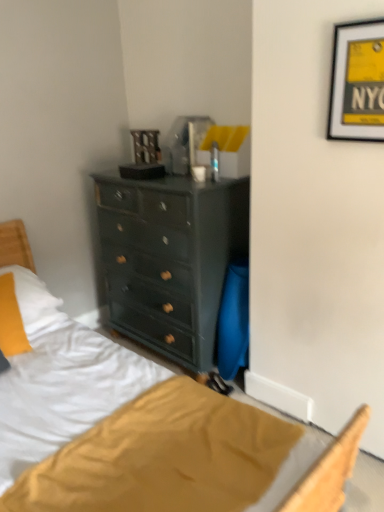
You are a GUI agent. You are given a task and a screenshot of the screen. Output one action in this format:
    pyautogui.click(x=<x>, y=<y>)
    Task: Click on the soft yellow pillow at lower left
    Image resolution: width=384 pixels, height=512 pixels.
    Given the screenshot: What is the action you would take?
    pyautogui.click(x=11, y=320)

The image size is (384, 512). Describe the element at coordinates (11, 320) in the screenshot. I see `soft yellow pillow at lower left` at that location.

Measure the distance between point [3,349] and camera.

Point [3,349] and camera are 6.99 feet apart.

This screenshot has width=384, height=512. Describe the element at coordinates (357, 82) in the screenshot. I see `black matte picture frame at upper right` at that location.

Measure the distance between black matte picture frame at upper right and camera.

A distance of 1.52 meters exists between black matte picture frame at upper right and camera.

Identify the location of black matte picture frame at upper right. (357, 82).

In order to click on soft yellow pillow at lower left in this screenshot , I will do `click(11, 320)`.

Is black matte picture frame at upper right to the left or to the right of soft yellow pillow at lower left in the image?

Based on their positions, black matte picture frame at upper right is located to the right of soft yellow pillow at lower left.

Is black matte picture frame at upper right positioned behind soft yellow pillow at lower left?

No, black matte picture frame at upper right is in front of soft yellow pillow at lower left.

Is point (371, 56) positioned behind point (8, 307)?

No, it is in front of (8, 307).

From the image's perspective, which one is positioned higher, black matte picture frame at upper right or soft yellow pillow at lower left?

black matte picture frame at upper right.

From a real-world perspective, is black matte picture frame at upper right on top of soft yellow pillow at lower left?

Yes, from a real-world perspective, black matte picture frame at upper right is on top of soft yellow pillow at lower left.

Which of these two, black matte picture frame at upper right or soft yellow pillow at lower left, is thinner?

black matte picture frame at upper right.

Is black matte picture frame at upper right taller than soft yellow pillow at lower left?

Incorrect, the height of black matte picture frame at upper right is not larger of that of soft yellow pillow at lower left.

Does black matte picture frame at upper right have a smaller size compared to soft yellow pillow at lower left?

Yes.

Is black matte picture frame at upper right completely or partially outside of soft yellow pillow at lower left?

That's correct, black matte picture frame at upper right is outside of soft yellow pillow at lower left.

Is black matte picture frame at upper right placed right next to soft yellow pillow at lower left?

No, black matte picture frame at upper right is not in contact with soft yellow pillow at lower left.

Is black matte picture frame at upper right aimed at soft yellow pillow at lower left?

No, black matte picture frame at upper right does not turn towards soft yellow pillow at lower left.

The height and width of the screenshot is (512, 384). I want to click on pillow behind the black matte picture frame at upper right, so click(x=11, y=320).

Considering the relative positions of soft yellow pillow at lower left and black matte picture frame at upper right in the image provided, is soft yellow pillow at lower left to the right of black matte picture frame at upper right from the viewer's perspective?

No.

Which object is closer to the camera taking this photo, soft yellow pillow at lower left or black matte picture frame at upper right?

black matte picture frame at upper right is more forward.

Does point (21, 350) come closer to viewer compared to point (370, 61)?

No, (21, 350) is behind (370, 61).

From the image's perspective, which is below, soft yellow pillow at lower left or black matte picture frame at upper right?

soft yellow pillow at lower left, from the image's perspective.

From a real-world perspective, is soft yellow pillow at lower left above or below black matte picture frame at upper right?

soft yellow pillow at lower left is below black matte picture frame at upper right.

Can you confirm if soft yellow pillow at lower left is thinner than black matte picture frame at upper right?

No.

Can you confirm if soft yellow pillow at lower left is taller than black matte picture frame at upper right?

Indeed, soft yellow pillow at lower left has a greater height compared to black matte picture frame at upper right.

Does soft yellow pillow at lower left have a larger size compared to black matte picture frame at upper right?

Correct, soft yellow pillow at lower left is larger in size than black matte picture frame at upper right.

Is soft yellow pillow at lower left outside of black matte picture frame at upper right?

Yes, soft yellow pillow at lower left is not within black matte picture frame at upper right.

Does soft yellow pillow at lower left touch black matte picture frame at upper right?

No, soft yellow pillow at lower left is not beside black matte picture frame at upper right.

Is soft yellow pillow at lower left oriented towards black matte picture frame at upper right?

No, soft yellow pillow at lower left is not oriented towards black matte picture frame at upper right.

How different are the orientations of soft yellow pillow at lower left and black matte picture frame at upper right in degrees?

The angular difference between soft yellow pillow at lower left and black matte picture frame at upper right is 66.5 degrees.

Image resolution: width=384 pixels, height=512 pixels. Identify the location of pillow below the black matte picture frame at upper right (from a real-world perspective). (11, 320).

The width and height of the screenshot is (384, 512). In order to click on pillow that appears below the black matte picture frame at upper right (from the image's perspective) in this screenshot , I will do `click(11, 320)`.

Find the location of a particular element. picture frame that appears above the soft yellow pillow at lower left (from the image's perspective) is located at coordinates (357, 82).